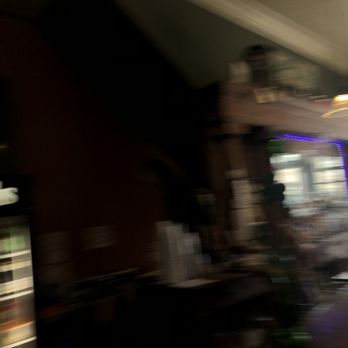
Find the location of a particular element. table is located at coordinates (230, 278).